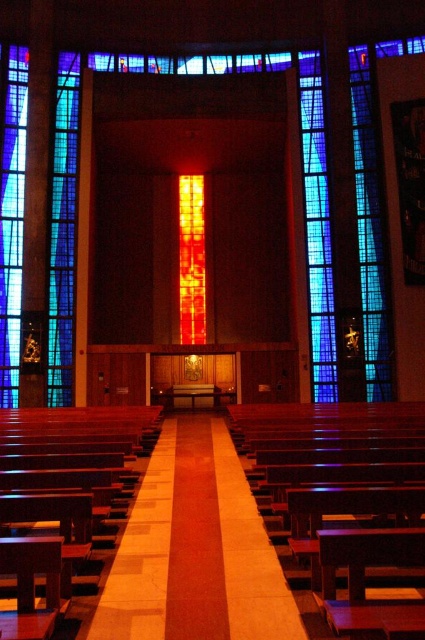
You are standing inside the church and want to take a photo of the point at coordinates (144, 545). The camera you are using has a maximum focus range of 20 meters. Will the camera be able to focus on the point?

The point at coordinates (144, 545) is 22.90 meters away from the camera, which exceeds the camera maximum focus range of 20 meters. Therefore, the camera will not be able to focus on the point.